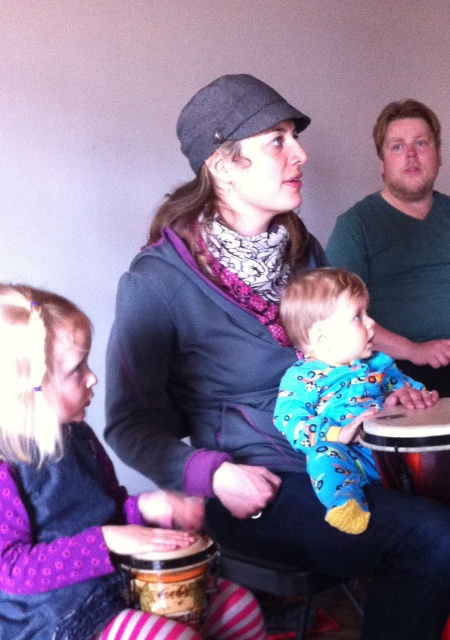
Consider the image. You are a photographer trying to capture a photo of the brown textured drum at center without any obstruction. Can you take the photo as it is, or do you need to move the floral pajamas at center first?

The floral pajamas at center is in front of the brown textured drum at center, so you need to move the floral pajamas at center to take an unobstructed photo of the brown textured drum at center.